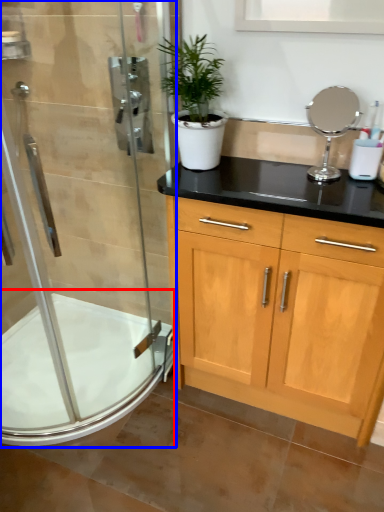
Question: Which point is closer to the camera, bath (highlighted by a red box) or shower door (highlighted by a blue box)?

Choices:
 (A) bath
 (B) shower door

Answer: (B)